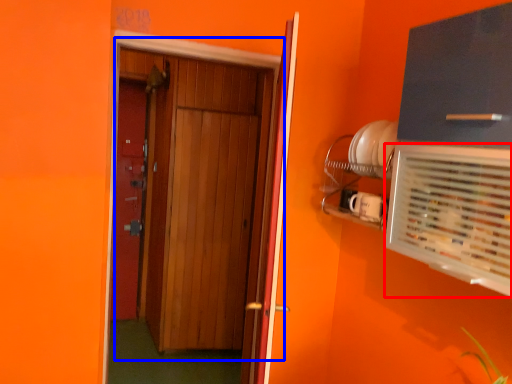
Question: Which object appears closest to the camera in this image, air conditioning (highlighted by a red box) or door (highlighted by a blue box)?

Choices:
 (A) air conditioning
 (B) door

Answer: (A)